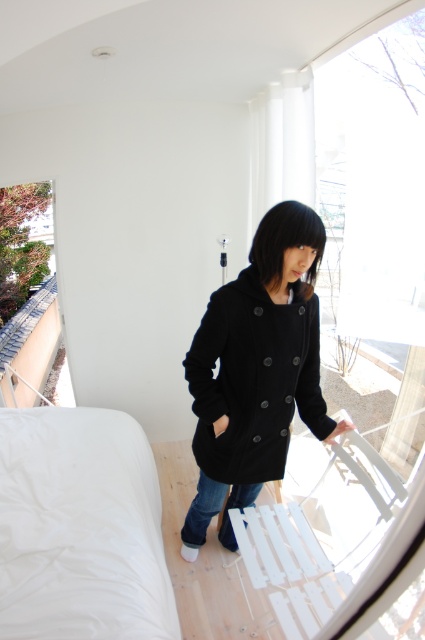
Is white soft bed at lower left to the left of black woolen coat at center from the viewer's perspective?

Yes, white soft bed at lower left is to the left of black woolen coat at center.

Measure the distance from white soft bed at lower left to black woolen coat at center.

21.24 inches

The width and height of the screenshot is (425, 640). Describe the element at coordinates (81, 529) in the screenshot. I see `white soft bed at lower left` at that location.

At what (x,y) coordinates should I click in order to perform the action: click on white soft bed at lower left. Please return your answer as a coordinate pair (x, y). The image size is (425, 640). Looking at the image, I should click on (81, 529).